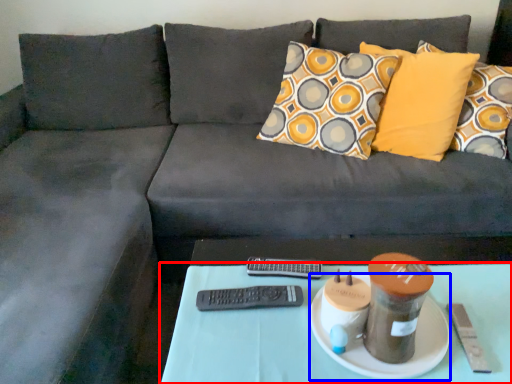
Question: Among these objects, which one is farthest to the camera, table (highlighted by a red box) or plate (highlighted by a blue box)?

Choices:
 (A) table
 (B) plate

Answer: (B)